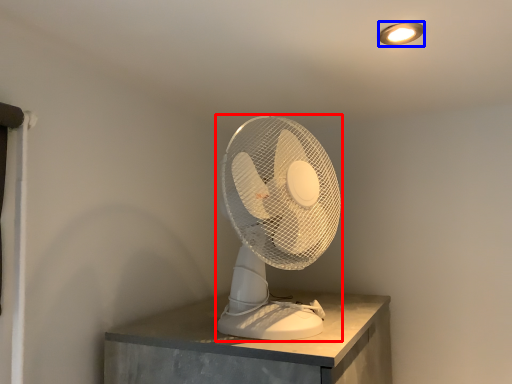
Question: Which point is further to the camera, mechanical fan (highlighted by a red box) or lamp (highlighted by a blue box)?

Choices:
 (A) mechanical fan
 (B) lamp

Answer: (B)